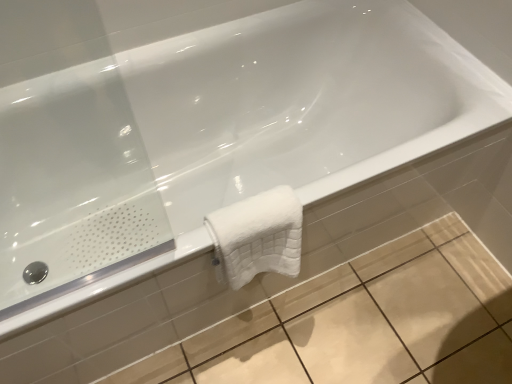
Describe the element at coordinates (258, 236) in the screenshot. The image size is (512, 384). I see `white fluffy towel at center` at that location.

Image resolution: width=512 pixels, height=384 pixels. In order to click on white fluffy towel at center in this screenshot , I will do `click(258, 236)`.

In order to click on white fluffy towel at center in this screenshot , I will do `click(258, 236)`.